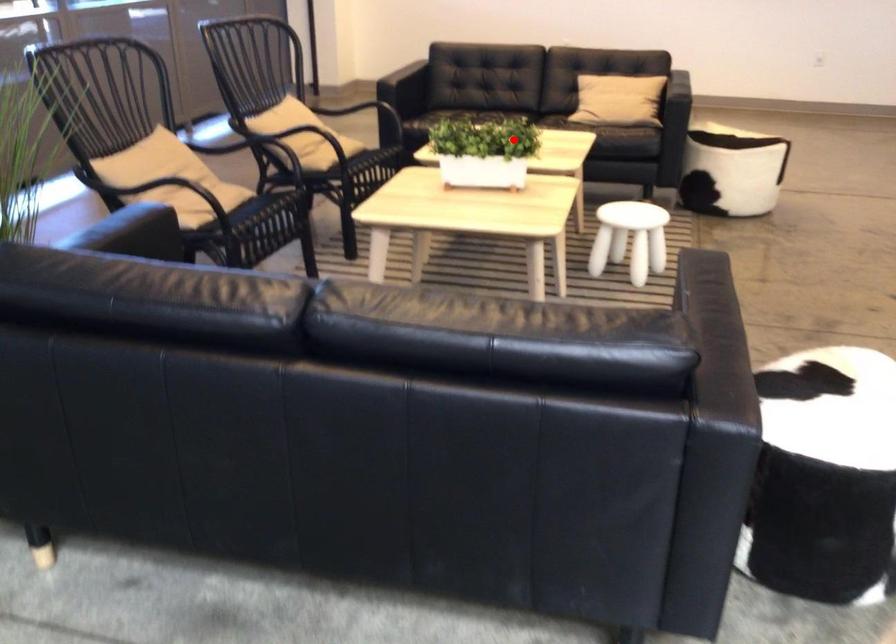
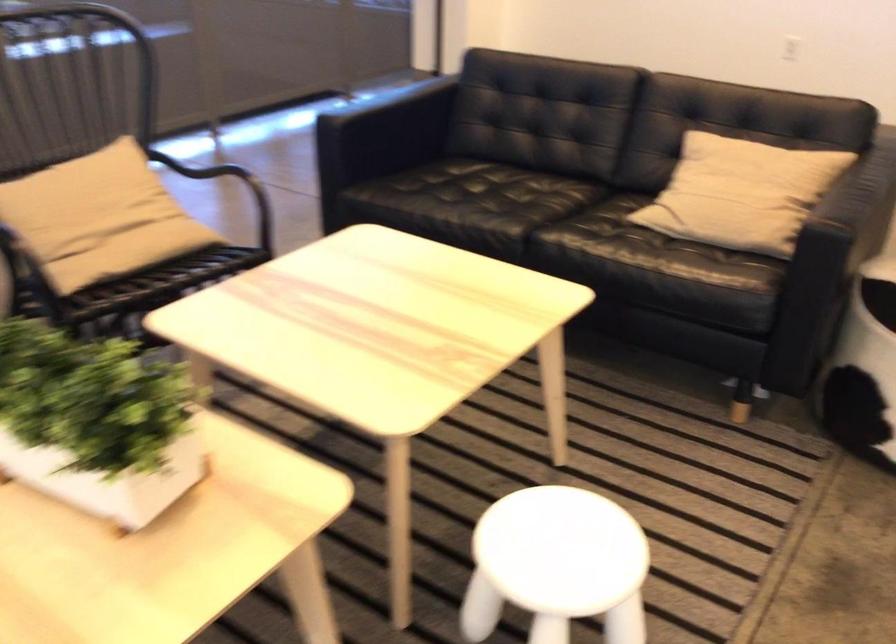
Question: I am providing you with two images of the same scene from different viewpoints. In image1, a red point is highlighted. Considering the same 3D point in image2, which of the following is correct?

Choices:
 (A) It is closer
 (B) It is farther

Answer: (A)